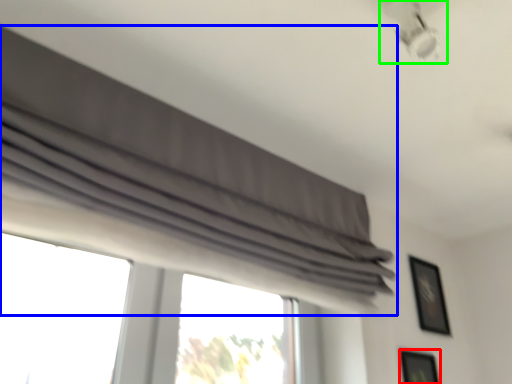
Question: Estimate the real-world distances between objects in this image. Which object is closer to picture frame (highlighted by a red box), curtain (highlighted by a blue box) or lamp (highlighted by a green box)?

Choices:
 (A) curtain
 (B) lamp

Answer: (A)